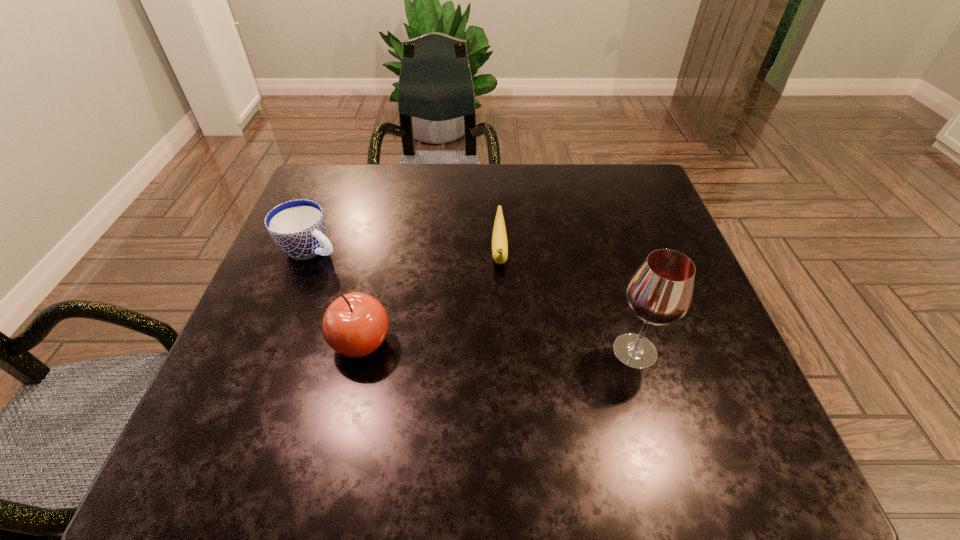
Locate an element on the screen. The height and width of the screenshot is (540, 960). vacant point located between the banana and the cup is located at coordinates (405, 251).

At what (x,y) coordinates should I click in order to perform the action: click on free space between the rightmost object and the third shortest object. Please return your answer as a coordinate pair (x, y). Looking at the image, I should click on (498, 347).

The width and height of the screenshot is (960, 540). What are the coordinates of `blank region between the tallest object and the third object from left to right` in the screenshot? It's located at (567, 302).

Identify the location of the second closest object to the leftmost object. (499, 237).

Find the location of a particular element. Image resolution: width=960 pixels, height=540 pixels. the third closest object relative to the apple is located at coordinates (660, 292).

Locate an element on the screen. This screenshot has width=960, height=540. vacant point that satisfies the following two spatial constraints: 1. on the back side of the second object from left to right; 2. on the left side of the third object from left to right is located at coordinates (382, 253).

Where is `free space in the image that satisfies the following two spatial constraints: 1. on the front side of the banana; 2. on the right side of the tallest object`? free space in the image that satisfies the following two spatial constraints: 1. on the front side of the banana; 2. on the right side of the tallest object is located at coordinates (504, 351).

In order to click on vacant space that satisfies the following two spatial constraints: 1. on the front side of the wineglass; 2. on the right side of the apple in this screenshot , I will do `click(359, 351)`.